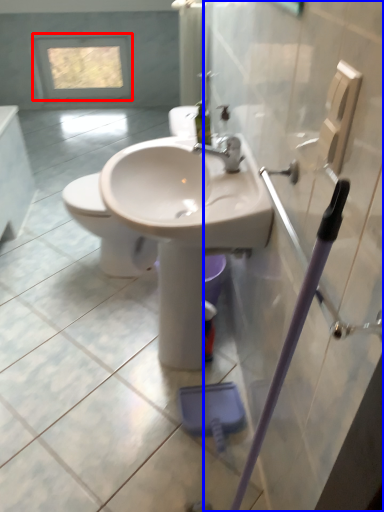
Question: Which object appears closest to the camera in this image, window (highlighted by a red box) or screen door (highlighted by a blue box)?

Choices:
 (A) window
 (B) screen door

Answer: (B)